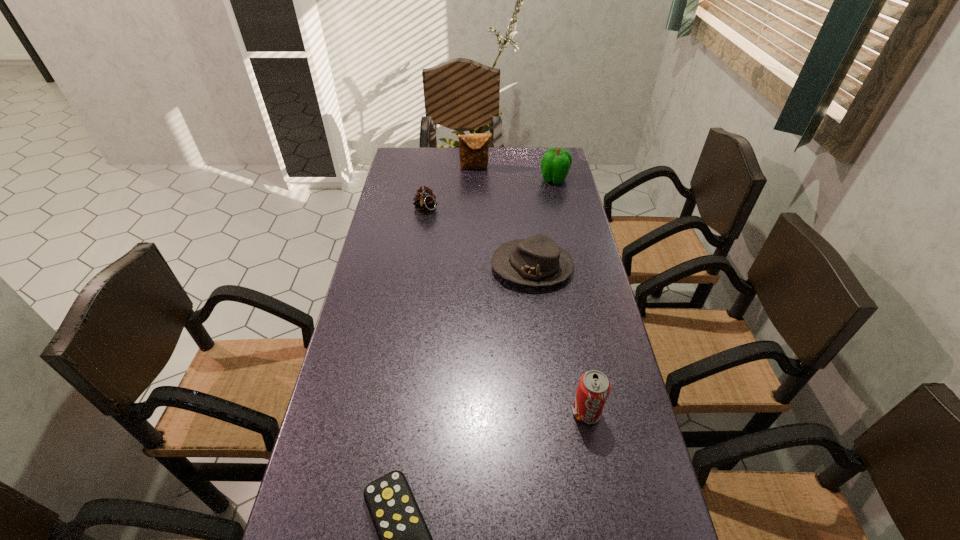
Where is `vacant space located 0.350m on the decorative side of the hat`? The height and width of the screenshot is (540, 960). vacant space located 0.350m on the decorative side of the hat is located at coordinates (381, 267).

Where is `vacant space located 0.290m on the decorative side of the hat`? This screenshot has width=960, height=540. vacant space located 0.290m on the decorative side of the hat is located at coordinates (400, 267).

Where is `clutch bag that is at the far edge`? clutch bag that is at the far edge is located at coordinates (473, 148).

What are the coordinates of `bell pepper that is at the far edge` in the screenshot? It's located at point(555,164).

This screenshot has height=540, width=960. Identify the location of object present at the left edge. (425, 201).

Where is `bell pepper located at the right edge`? Image resolution: width=960 pixels, height=540 pixels. bell pepper located at the right edge is located at coordinates (555, 164).

Identify the location of soda can located at the right edge. (594, 387).

I want to click on hat at the right edge, so click(537, 261).

Find the location of `object located at the far right corner`. object located at the far right corner is located at coordinates tap(555, 164).

Identify the location of vacant area at the left edge of the desktop. (406, 252).